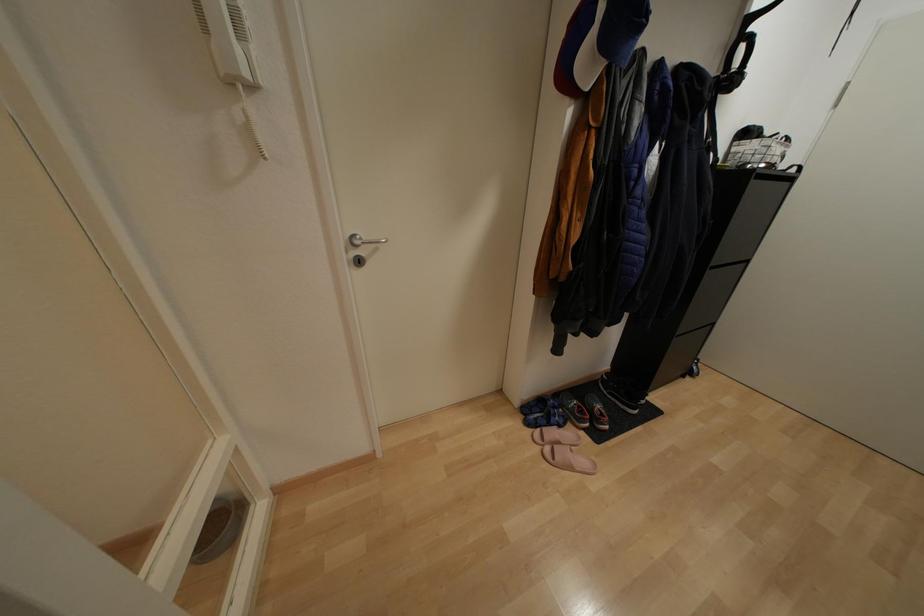
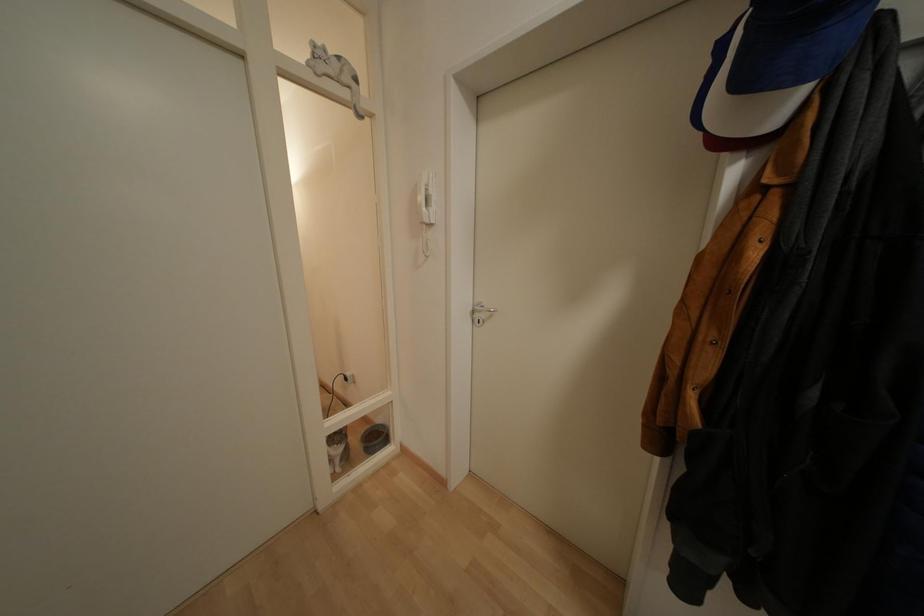
Question: The camera is either moving clockwise (left) or counter-clockwise (right) around the object. The first image is from the beginning of the video and the second image is from the end. Is the camera moving left or right when shooting the video?

Choices:
 (A) Left
 (B) Right

Answer: (B)